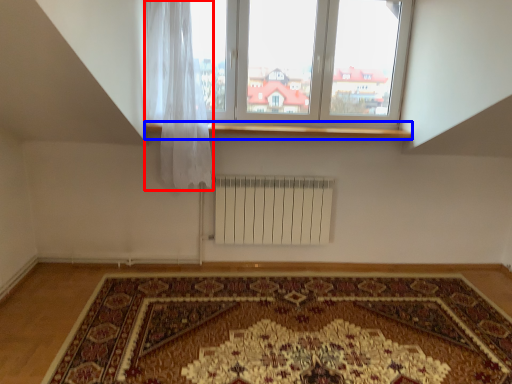
Question: Which object appears closest to the camera in this image, curtain (highlighted by a red box) or window sill (highlighted by a blue box)?

Choices:
 (A) curtain
 (B) window sill

Answer: (A)